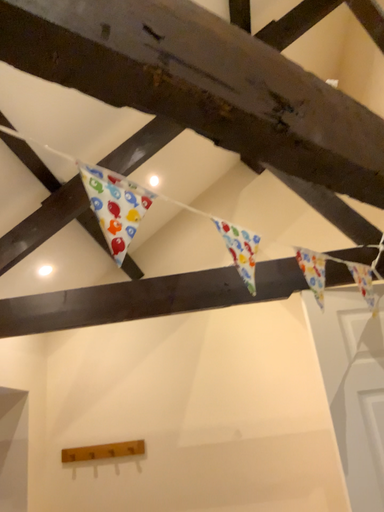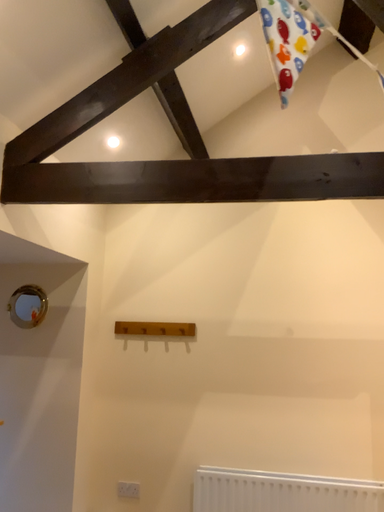
Question: How did the camera likely rotate when shooting the video?

Choices:
 (A) rotated downward
 (B) rotated upward

Answer: (A)